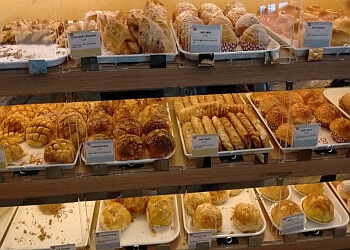
I want to click on empty tray, so click(x=54, y=227).